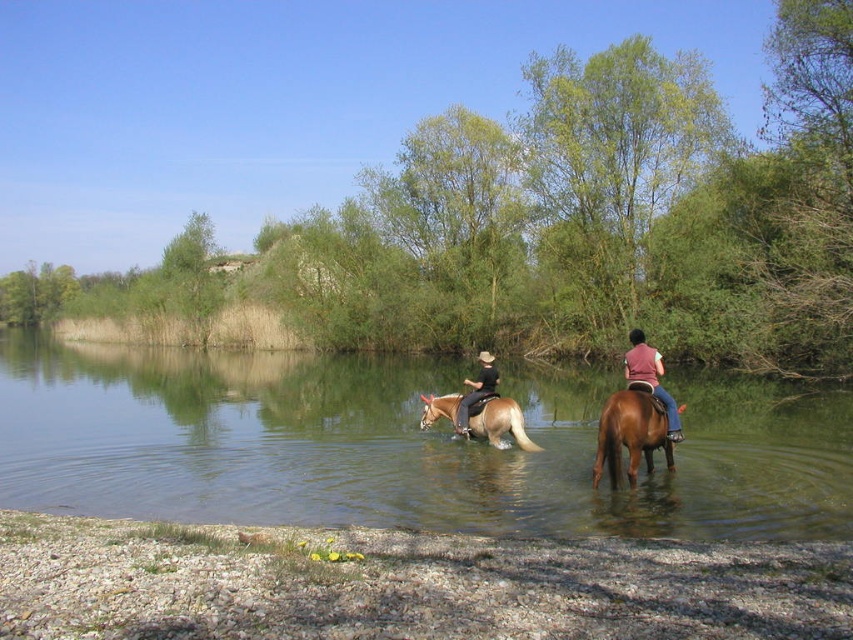
You are a photographer aiming to capture a photo of the light brown glossy horse at center and the dark brown leather pants at center. From your current position, which object is closer to you?

The light brown glossy horse at center is closer to you since it is positioned in front of the dark brown leather pants at center.

You are a photographer standing at the edge of the water. You want to take a photo of the brown glossy horse at center and the brown leather vest at center. If your camera has a depth of field that can focus on objects within 36 inches of each other, will both subjects be in focus?

The distance between the brown glossy horse at center and the brown leather vest at center is 38.42 inches, which exceeds the camera depth of field range of 36 inches. Therefore, both subjects cannot be in focus simultaneously.